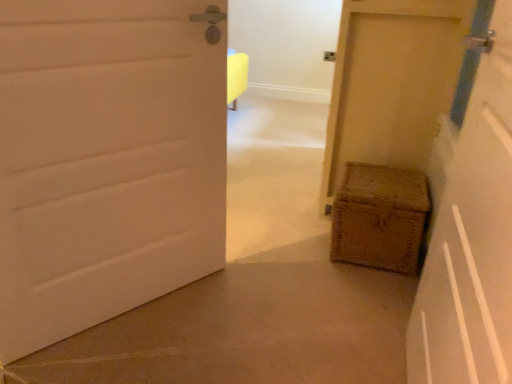
Where is `white matte door at left, the 1th door when ordered from left to right`? The height and width of the screenshot is (384, 512). white matte door at left, the 1th door when ordered from left to right is located at coordinates (105, 160).

Where is `woven wood chest at lower right, which ranks as the 1th door in right-to-left order`? The image size is (512, 384). woven wood chest at lower right, which ranks as the 1th door in right-to-left order is located at coordinates (392, 82).

Describe the element at coordinates (392, 82) in the screenshot. This screenshot has height=384, width=512. I see `woven wood chest at lower right, acting as the third door starting from the left` at that location.

Identify the location of white matte door at left, the 1th door when ordered from left to right. click(105, 160).

Is woven wood chest at lower right, acting as the third door starting from the left, looking in the opposite direction of white matte door at left, which is the 3th door from right to left?

woven wood chest at lower right, acting as the third door starting from the left, does not have its back to white matte door at left, which is the 3th door from right to left.

Measure the distance between woven wood chest at lower right, which ranks as the 1th door in right-to-left order, and white matte door at left, the 1th door when ordered from left to right.

woven wood chest at lower right, which ranks as the 1th door in right-to-left order, is 37.74 inches away from white matte door at left, the 1th door when ordered from left to right.

From the picture: Do you think woven wood chest at lower right, acting as the third door starting from the left, is within white matte door at left, which is the 3th door from right to left, or outside of it?

woven wood chest at lower right, acting as the third door starting from the left, exists outside the volume of white matte door at left, which is the 3th door from right to left.

Between woven wood chest at lower right, which ranks as the 1th door in right-to-left order, and white matte door at left, the 1th door when ordered from left to right, which one has smaller size?

white matte door at left, the 1th door when ordered from left to right.

From a real-world perspective, is white matte door at left, which is the 3th door from right to left, on top of matte yellow door at right, arranged as the 2th door when viewed from the left?

No, from a real-world perspective, white matte door at left, which is the 3th door from right to left, is not over matte yellow door at right, arranged as the 2th door when viewed from the left

How different are the orientations of white matte door at left, which is the 3th door from right to left, and matte yellow door at right, which is the second door from right to left, in degrees?

The facing directions of white matte door at left, which is the 3th door from right to left, and matte yellow door at right, which is the second door from right to left, are 28.8 degrees apart.

In terms of height, does white matte door at left, which is the 3th door from right to left, look taller or shorter compared to matte yellow door at right, arranged as the 2th door when viewed from the left?

In the image, white matte door at left, which is the 3th door from right to left, appears to be shorter than matte yellow door at right, arranged as the 2th door when viewed from the left.

Are woven wood chest at lower right, acting as the third door starting from the left, and woven brown basket at lower right making contact?

There is a gap between woven wood chest at lower right, acting as the third door starting from the left, and woven brown basket at lower right.

Is woven wood chest at lower right, which ranks as the 1th door in right-to-left order, in front of or behind woven brown basket at lower right in the image?

Clearly, woven wood chest at lower right, which ranks as the 1th door in right-to-left order, is in front of woven brown basket at lower right.

Between point (391, 70) and point (404, 244), which one is positioned in front?

The point (404, 244) is closer to the camera.

Can you tell me how much woven wood chest at lower right, which ranks as the 1th door in right-to-left order, and woven brown basket at lower right differ in facing direction?

The angle between the facing direction of woven wood chest at lower right, which ranks as the 1th door in right-to-left order, and the facing direction of woven brown basket at lower right is 1.19 degrees.

Between woven brown basket at lower right and white matte door at left, which is the 3th door from right to left, which one has smaller size?

woven brown basket at lower right is smaller.

Is woven brown basket at lower right far from white matte door at left, which is the 3th door from right to left?

woven brown basket at lower right is near white matte door at left, which is the 3th door from right to left, not far away.

What's the angular difference between woven brown basket at lower right and white matte door at left, the 1th door when ordered from left to right,'s facing directions?

The facing directions of woven brown basket at lower right and white matte door at left, the 1th door when ordered from left to right, are 31 degrees apart.

Can we say woven brown basket at lower right lies outside white matte door at left, which is the 3th door from right to left?

Yes, woven brown basket at lower right is outside of white matte door at left, which is the 3th door from right to left.

Considering the sizes of objects woven brown basket at lower right and woven wood chest at lower right, acting as the third door starting from the left, in the image provided, who is thinner, woven brown basket at lower right or woven wood chest at lower right, acting as the third door starting from the left,?

Thinner between the two is woven brown basket at lower right.

From a real-world perspective, is woven brown basket at lower right physically located above or below woven wood chest at lower right, which ranks as the 1th door in right-to-left order?

From a real-world perspective, woven brown basket at lower right is physically below woven wood chest at lower right, which ranks as the 1th door in right-to-left order.

Does woven brown basket at lower right have a smaller size compared to woven wood chest at lower right, which ranks as the 1th door in right-to-left order?

Correct, woven brown basket at lower right occupies less space than woven wood chest at lower right, which ranks as the 1th door in right-to-left order.

From their relative heights in the image, would you say woven brown basket at lower right is taller or shorter than woven wood chest at lower right, which ranks as the 1th door in right-to-left order?

In the image, woven brown basket at lower right appears to be shorter than woven wood chest at lower right, which ranks as the 1th door in right-to-left order.

Considering the points (492, 98) and (352, 194), which point is in front, point (492, 98) or point (352, 194)?

Point (492, 98)

Could you tell me if matte yellow door at right, arranged as the 2th door when viewed from the left, is turned towards woven brown basket at lower right?

No, matte yellow door at right, arranged as the 2th door when viewed from the left, does not turn towards woven brown basket at lower right.

From the picture: Does matte yellow door at right, arranged as the 2th door when viewed from the left, have a larger size compared to woven brown basket at lower right?

Yes, matte yellow door at right, arranged as the 2th door when viewed from the left, is bigger than woven brown basket at lower right.

Which of these two, matte yellow door at right, which is the second door from right to left, or woven brown basket at lower right, is thinner?

Thinner between the two is matte yellow door at right, which is the second door from right to left.

Which of these two, white matte door at left, which is the 3th door from right to left, or woven wood chest at lower right, which ranks as the 1th door in right-to-left order, is wider?

With larger width is woven wood chest at lower right, which ranks as the 1th door in right-to-left order.

In the scene shown: Is white matte door at left, which is the 3th door from right to left, touching woven wood chest at lower right, which ranks as the 1th door in right-to-left order?

No, white matte door at left, which is the 3th door from right to left, is not in contact with woven wood chest at lower right, which ranks as the 1th door in right-to-left order.

Between white matte door at left, the 1th door when ordered from left to right, and woven wood chest at lower right, which ranks as the 1th door in right-to-left order, which one appears on the right side from the viewer's perspective?

woven wood chest at lower right, which ranks as the 1th door in right-to-left order.

The width and height of the screenshot is (512, 384). I want to click on door beneath the woven wood chest at lower right, acting as the third door starting from the left (from a real-world perspective), so click(x=105, y=160).

Locate an element on the screen. Image resolution: width=512 pixels, height=384 pixels. door that is the 1st object located behind the matte yellow door at right, which is the second door from right to left is located at coordinates (105, 160).

When comparing their distances from woven brown basket at lower right, does white matte door at left, which is the 3th door from right to left, or matte yellow door at right, arranged as the 2th door when viewed from the left, seem further?

The object further to woven brown basket at lower right is white matte door at left, which is the 3th door from right to left.

Estimate the real-world distances between objects in this image. Which object is further from woven wood chest at lower right, acting as the third door starting from the left, white matte door at left, the 1th door when ordered from left to right, or matte yellow door at right, which is the second door from right to left?

white matte door at left, the 1th door when ordered from left to right, is positioned further to the anchor woven wood chest at lower right, acting as the third door starting from the left.

Based on their spatial positions, is woven brown basket at lower right or woven wood chest at lower right, which ranks as the 1th door in right-to-left order, closer to white matte door at left, which is the 3th door from right to left?

woven brown basket at lower right is closer to white matte door at left, which is the 3th door from right to left.

Looking at the image, which one is located further to woven brown basket at lower right, woven wood chest at lower right, which ranks as the 1th door in right-to-left order, or matte yellow door at right, arranged as the 2th door when viewed from the left?

Based on the image, matte yellow door at right, arranged as the 2th door when viewed from the left, appears to be further to woven brown basket at lower right.

Considering their positions, is woven brown basket at lower right positioned further to matte yellow door at right, which is the second door from right to left, than white matte door at left, the 1th door when ordered from left to right?

white matte door at left, the 1th door when ordered from left to right, is further to matte yellow door at right, which is the second door from right to left.

From the image, which object appears to be nearer to woven brown basket at lower right, matte yellow door at right, arranged as the 2th door when viewed from the left, or woven wood chest at lower right, which ranks as the 1th door in right-to-left order?

woven wood chest at lower right, which ranks as the 1th door in right-to-left order.

Estimate the real-world distances between objects in this image. Which object is further from woven wood chest at lower right, which ranks as the 1th door in right-to-left order, white matte door at left, the 1th door when ordered from left to right, or woven brown basket at lower right?

white matte door at left, the 1th door when ordered from left to right, is positioned further to the anchor woven wood chest at lower right, which ranks as the 1th door in right-to-left order.

When comparing their distances from woven brown basket at lower right, does white matte door at left, which is the 3th door from right to left, or woven wood chest at lower right, which ranks as the 1th door in right-to-left order, seem closer?

woven wood chest at lower right, which ranks as the 1th door in right-to-left order, is closer to woven brown basket at lower right.

Find the location of a particular element. door located between white matte door at left, which is the 3th door from right to left, and woven wood chest at lower right, acting as the third door starting from the left, in the left-right direction is located at coordinates (472, 240).

Where is `basket between white matte door at left, which is the 3th door from right to left, and woven wood chest at lower right, which ranks as the 1th door in right-to-left order, in the horizontal direction`? This screenshot has width=512, height=384. basket between white matte door at left, which is the 3th door from right to left, and woven wood chest at lower right, which ranks as the 1th door in right-to-left order, in the horizontal direction is located at coordinates (380, 217).